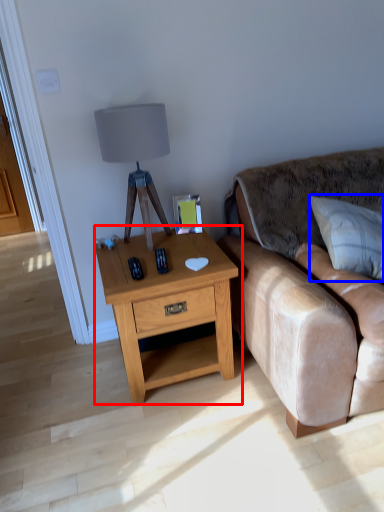
Question: Which point is closer to the camera, nightstand (highlighted by a red box) or pillow (highlighted by a blue box)?

Choices:
 (A) nightstand
 (B) pillow

Answer: (B)